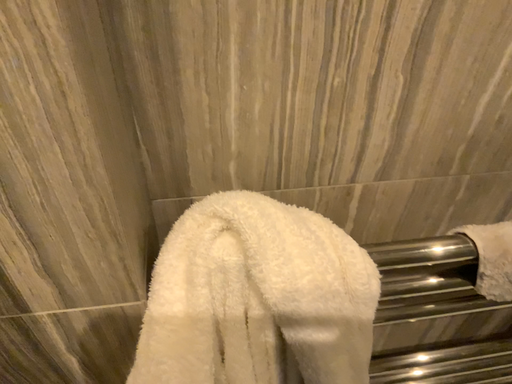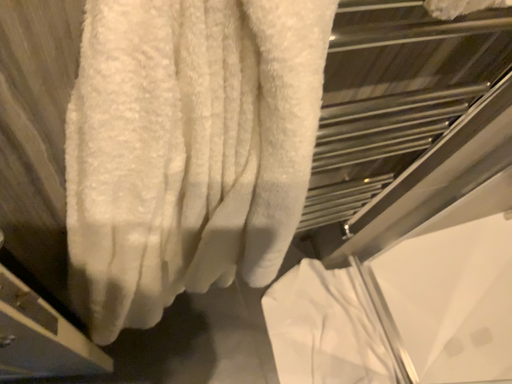
Question: Which way did the camera rotate in the video?

Choices:
 (A) rotated left
 (B) rotated right

Answer: (B)